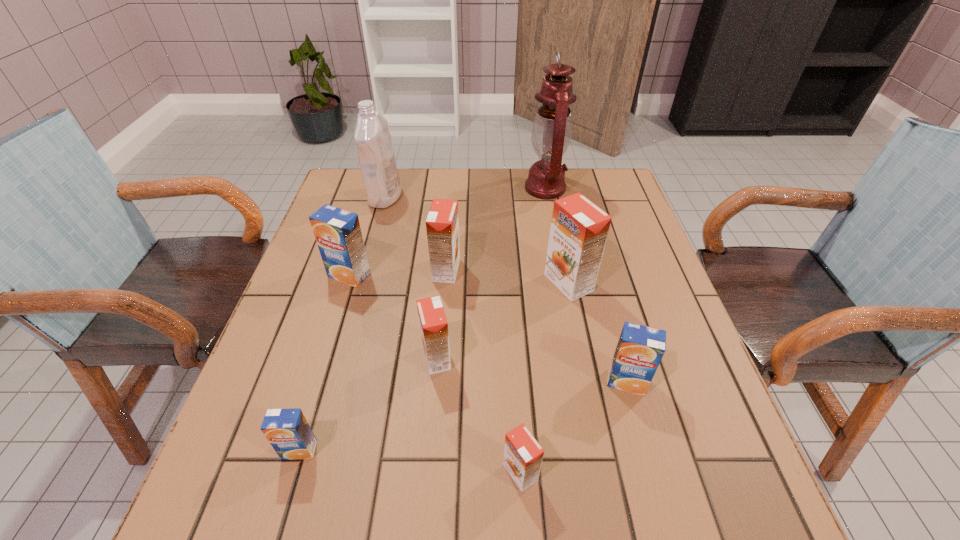
Locate an element on the screen. The height and width of the screenshot is (540, 960). vacant space that is in between the second nearest orange orange juice and the tallest object is located at coordinates click(x=491, y=273).

At what (x,y) coordinates should I click in order to perform the action: click on vacant space that is in between the third farthest orange orange juice and the seventh shortest object. Please return your answer as a coordinate pair (x, y). Image resolution: width=960 pixels, height=540 pixels. Looking at the image, I should click on (503, 320).

What are the coordinates of `free area in between the second biggest orange orange juice and the biggest orange orange juice` in the screenshot? It's located at (508, 276).

This screenshot has height=540, width=960. Identify the location of free spot between the tallest orange juice and the biggest blue orange_juice. (459, 279).

This screenshot has height=540, width=960. Find the location of `the seventh closest object to the detergent`. the seventh closest object to the detergent is located at coordinates (640, 348).

Identify which object is the fifth nearest to the third smallest orange orange juice. Please provide its 2D coordinates. Your answer should be formatted as a tuple, i.e. [(x, y)], where the tuple contains the x and y coordinates of a point satisfying the conditions above.

[(552, 128)]

Identify the location of orange juice that is the third closest to the seventh shortest object. (433, 324).

Find the location of `orange juice that is the third closest to the tallest object`. orange juice that is the third closest to the tallest object is located at coordinates pyautogui.click(x=338, y=234).

Locate which orange orange juice is the third closest to the farthest blue orange_juice. Please provide its 2D coordinates. Your answer should be formatted as a tuple, i.e. [(x, y)], where the tuple contains the x and y coordinates of a point satisfying the conditions above.

[(579, 229)]

Locate which orange orange juice ranks in proximity to the second nearest orange orange juice. Please provide its 2D coordinates. Your answer should be formatted as a tuple, i.e. [(x, y)], where the tuple contains the x and y coordinates of a point satisfying the conditions above.

[(442, 225)]